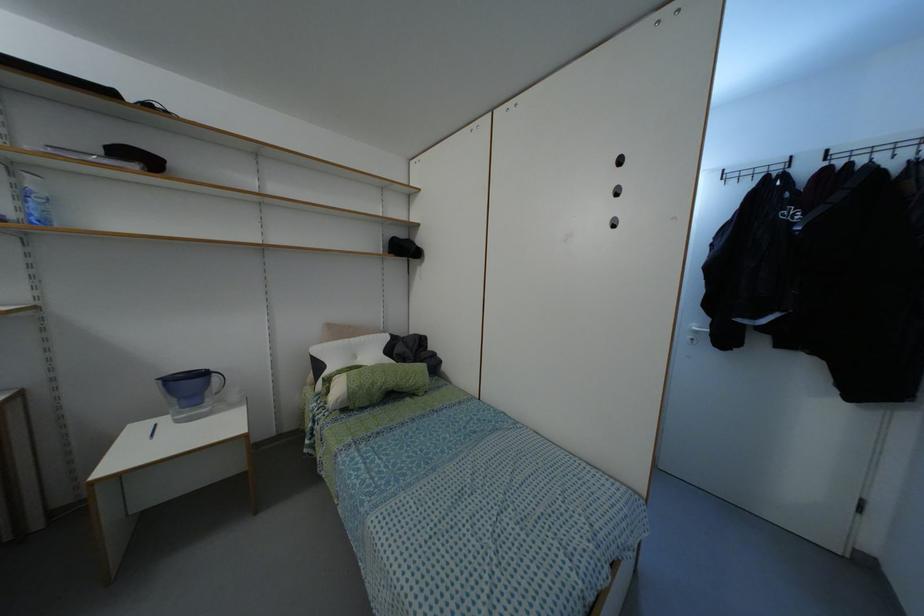
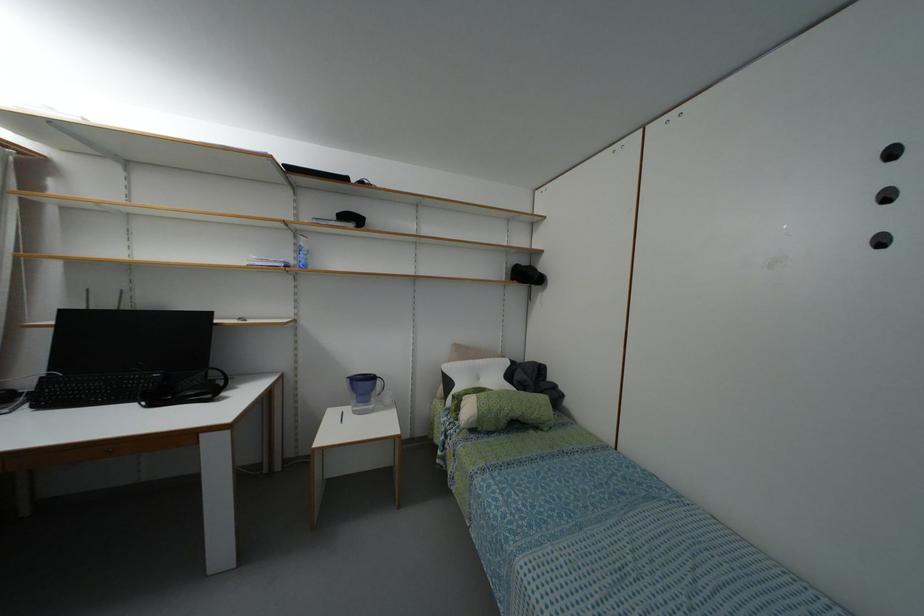
Question: In a continuous first-person perspective shot, in which direction is the camera moving?

Choices:
 (A) Left
 (B) Right
 (C) Forward
 (D) Backward

Answer: (A)